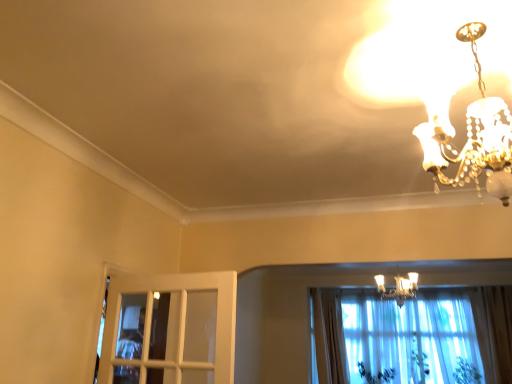
Question: Are green leafy plant at lower right, arranged as the 3th plant when viewed from the left, and green leafy plant at lower right, acting as the 2th plant starting from the right, making contact?

Choices:
 (A) yes
 (B) no

Answer: (B)

Question: Would you say green leafy plant at lower right, arranged as the 3th plant when viewed from the left, is a long distance from green leafy plant at lower right, which ranks as the 2th plant in left-to-right order?

Choices:
 (A) no
 (B) yes

Answer: (A)

Question: Is green leafy plant at lower right, the first plant viewed from the right, outside green leafy plant at lower right, which ranks as the 2th plant in left-to-right order?

Choices:
 (A) yes
 (B) no

Answer: (A)

Question: Is green leafy plant at lower right, the first plant viewed from the right, shorter than green leafy plant at lower right, which ranks as the 2th plant in left-to-right order?

Choices:
 (A) yes
 (B) no

Answer: (A)

Question: Is green leafy plant at lower right, the first plant viewed from the right, further to the viewer compared to green leafy plant at lower right, which ranks as the 2th plant in left-to-right order?

Choices:
 (A) no
 (B) yes

Answer: (A)

Question: From a real-world perspective, relative to light beige fabric curtain at lower center, is green leafy plant at lower right, arranged as the first plant when viewed from the left, vertically above or below?

Choices:
 (A) above
 (B) below

Answer: (B)

Question: Relative to light beige fabric curtain at lower center, is green leafy plant at lower right, arranged as the first plant when viewed from the left, in front or behind?

Choices:
 (A) front
 (B) behind

Answer: (B)

Question: Based on their sizes in the image, would you say green leafy plant at lower right, arranged as the first plant when viewed from the left, is bigger or smaller than light beige fabric curtain at lower center?

Choices:
 (A) big
 (B) small

Answer: (B)

Question: Choose the correct answer: Is green leafy plant at lower right, arranged as the first plant when viewed from the left, inside light beige fabric curtain at lower center or outside it?

Choices:
 (A) outside
 (B) inside

Answer: (A)

Question: Is green leafy plant at lower right, arranged as the first plant when viewed from the left, spatially inside gold metallic chandelier at upper right, the 1th lamp viewed from the back, or outside of it?

Choices:
 (A) outside
 (B) inside

Answer: (A)

Question: From their relative heights in the image, would you say green leafy plant at lower right, placed as the third plant when sorted from right to left, is taller or shorter than gold metallic chandelier at upper right, the first lamp in the right-to-left sequence?

Choices:
 (A) short
 (B) tall

Answer: (A)

Question: Looking at the image, does green leafy plant at lower right, arranged as the first plant when viewed from the left, seem bigger or smaller compared to gold metallic chandelier at upper right, the 1th lamp viewed from the back?

Choices:
 (A) big
 (B) small

Answer: (B)

Question: Is green leafy plant at lower right, placed as the third plant when sorted from right to left, wider or thinner than gold metallic chandelier at upper right, which appears as the first lamp when ordered from the bottom?

Choices:
 (A) wide
 (B) thin

Answer: (B)

Question: From a real-world perspective, relative to green leafy plant at lower right, arranged as the 3th plant when viewed from the left, is light beige fabric curtain at lower center vertically above or below?

Choices:
 (A) above
 (B) below

Answer: (A)

Question: Considering the relative positions of light beige fabric curtain at lower center and green leafy plant at lower right, arranged as the 3th plant when viewed from the left, in the image provided, is light beige fabric curtain at lower center to the left or to the right of green leafy plant at lower right, arranged as the 3th plant when viewed from the left,?

Choices:
 (A) right
 (B) left

Answer: (B)